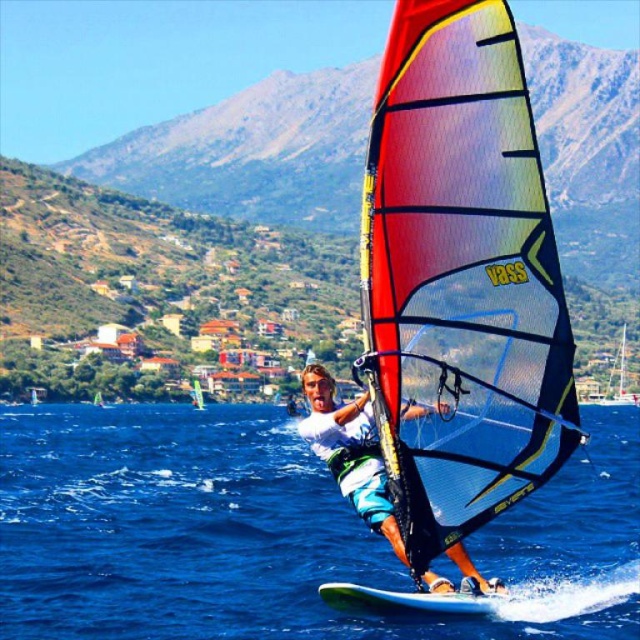
Who is positioned more to the left, multicolored mesh sail at center or translucent yellow sail at center?

Positioned to the left is translucent yellow sail at center.

The height and width of the screenshot is (640, 640). What do you see at coordinates (461, 276) in the screenshot?
I see `multicolored mesh sail at center` at bounding box center [461, 276].

Looking at this image, who is more distant from viewer, (x=529, y=104) or (x=196, y=378)?

Point (x=196, y=378)

The height and width of the screenshot is (640, 640). I want to click on multicolored mesh sail at center, so click(461, 276).

Who is more forward, (355, 477) or (193, 385)?

Positioned in front is point (355, 477).

The width and height of the screenshot is (640, 640). Identify the location of matte white windsurfing board at center. pos(349,452).

What do you see at coordinates (276, 532) in the screenshot?
I see `blue water at center` at bounding box center [276, 532].

Between blue water at center and matte white windsurfing board at center, which one has less height?

blue water at center is shorter.

Who is more distant from viewer, (230,586) or (371,412)?

The point (230,586) is behind.

Locate an element on the screen. The width and height of the screenshot is (640, 640). blue water at center is located at coordinates (276, 532).